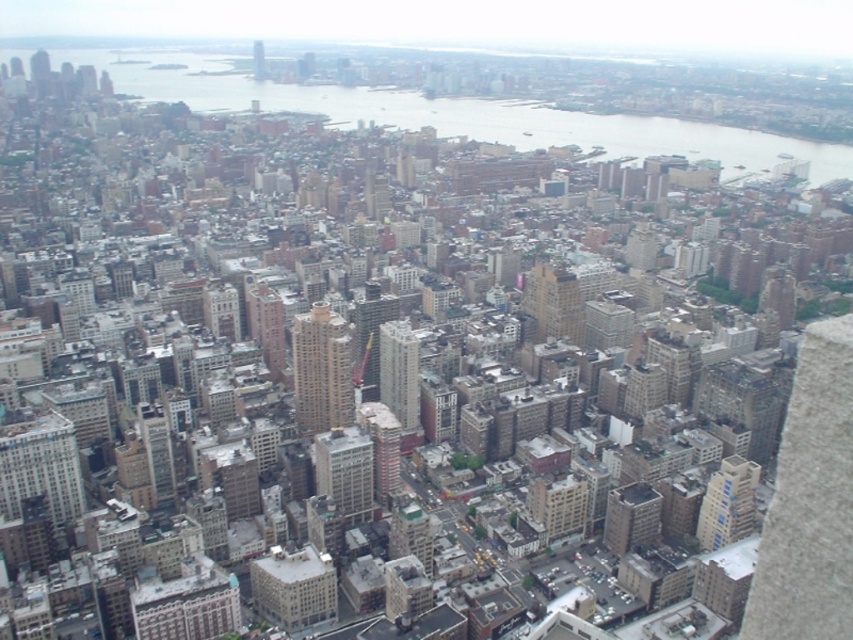
You are a drone operator tasked with capturing aerial footage of the city. Your drone is currently at the center of the image. Which direction should you move the drone to capture a clear shot of the matte glass skyscraper at center?

The matte glass skyscraper at center is already at the center of the image, so you don not need to move the drone in any direction. It is already positioned to capture the skyscraper.